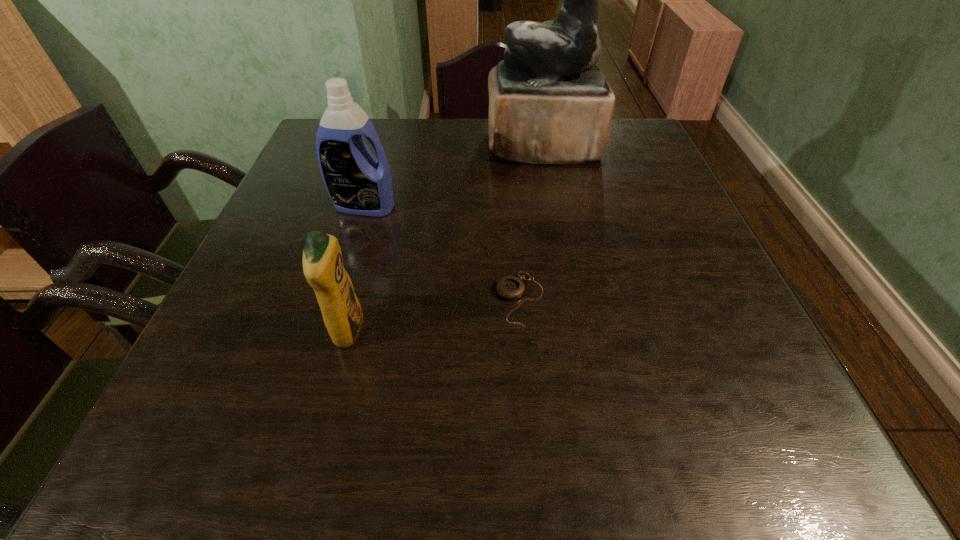
Where is `sculpture`? Image resolution: width=960 pixels, height=540 pixels. sculpture is located at coordinates (549, 103).

The height and width of the screenshot is (540, 960). Find the location of `the tallest object`. the tallest object is located at coordinates (549, 103).

In order to click on the farther detergent in this screenshot , I will do `click(358, 183)`.

Identify the location of the third shortest object. (358, 183).

This screenshot has width=960, height=540. Identify the location of the shorter detergent. pos(323,268).

I want to click on the nearer detergent, so click(323, 268).

Locate an element on the screen. This screenshot has height=540, width=960. pocket watch is located at coordinates (509, 287).

The height and width of the screenshot is (540, 960). In order to click on free space located in a relaxed pose on the sculpture in this screenshot , I will do `click(467, 144)`.

What are the coordinates of `free location located 0.250m in a relaxed pose on the sculpture` in the screenshot? It's located at point(398,144).

Find the location of a particular element. This screenshot has width=960, height=540. vacant region located in a relaxed pose on the sculpture is located at coordinates (417, 144).